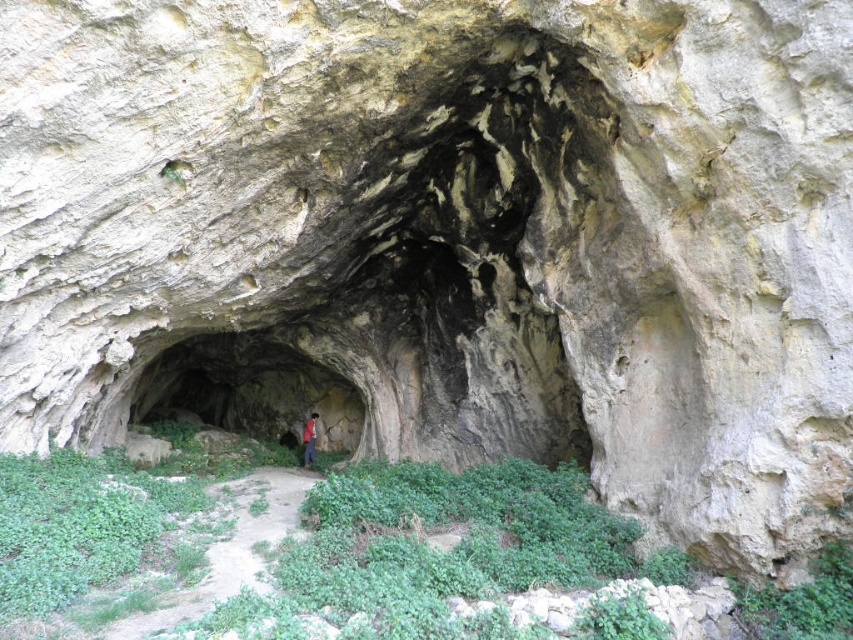
Which is in front, point (328, 419) or point (314, 424)?

Point (314, 424) is in front.

Locate an element on the screen. The image size is (853, 640). green mossy cave at center is located at coordinates (248, 390).

This screenshot has width=853, height=640. Find the location of `green mossy cave at center`. green mossy cave at center is located at coordinates (248, 390).